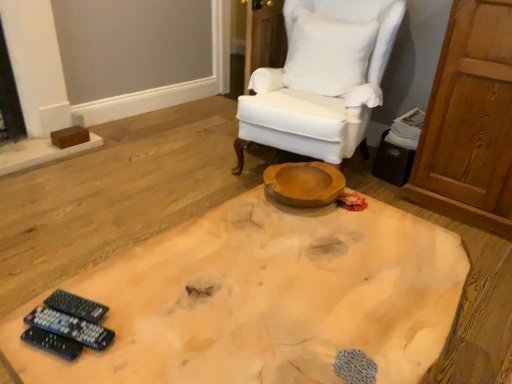
What are the coordinates of `white cotton pillow at upper right` in the screenshot? It's located at pos(327,53).

What do you see at coordinates (327, 53) in the screenshot? I see `white cotton pillow at upper right` at bounding box center [327, 53].

Find the location of a particular element. Image resolution: width=512 pixels, height=384 pixels. white fabric chair at upper center is located at coordinates (324, 83).

You are a GUI agent. You are given a task and a screenshot of the screen. Output one action in this format:
    pyautogui.click(x=<x>, y=<y>)
    Task: Click on the white cotton pillow at upper right
    The image size is (512, 384).
    Given the screenshot: What is the action you would take?
    pyautogui.click(x=327, y=53)

From a real-world perspective, is black plastic remote controls at lower left, the 3th remote control positioned from the front, physically located above or below white cotton pillow at upper right?

Clearly, from a real-world perspective, black plastic remote controls at lower left, the 3th remote control positioned from the front, is below white cotton pillow at upper right.

Considering the sizes of objects black plastic remote controls at lower left, the 1th remote control viewed from the back, and white cotton pillow at upper right in the image provided, who is shorter, black plastic remote controls at lower left, the 1th remote control viewed from the back, or white cotton pillow at upper right?

Standing shorter between the two is black plastic remote controls at lower left, the 1th remote control viewed from the back.

From the picture: Does black plastic remote controls at lower left, the 3th remote control positioned from the front, come behind white cotton pillow at upper right?

No, black plastic remote controls at lower left, the 3th remote control positioned from the front, is closer to the viewer.

Where is `pillow on the right of the black plastic remote controls at lower left, the 3th remote control positioned from the front`? Image resolution: width=512 pixels, height=384 pixels. pillow on the right of the black plastic remote controls at lower left, the 3th remote control positioned from the front is located at coordinates (327, 53).

What's the angular difference between black plastic remote controls at lower left, the 1th remote control viewed from the back, and natural wood coffee table at center's facing directions?

They differ by 20.6 degrees in their facing directions.

From a real-world perspective, which object rests below the other?

natural wood coffee table at center, from a real-world perspective.

Visually, is black plastic remote controls at lower left, the 1th remote control viewed from the back, positioned to the left or to the right of natural wood coffee table at center?

black plastic remote controls at lower left, the 1th remote control viewed from the back, is to the left of natural wood coffee table at center.

Does point (98, 321) come closer to viewer compared to point (198, 305)?

Yes, point (98, 321) is in front of point (198, 305).

Measure the distance from black plastic remote controls at lower left, arranged as the 1th remote control when viewed from the front, to black plastic remote controls at lower left, the 2th remote control viewed from the back.

2.79 centimeters.

Identify the location of the 1st remote control positioned above the black plastic remote controls at lower left, which ranks as the 3th remote control in back-to-front order (from the image's perspective). The height and width of the screenshot is (384, 512). (70, 327).

Is black plastic remote controls at lower left, arranged as the 1th remote control when viewed from the front, located outside black plastic remote controls at lower left, the 2th remote control viewed from the back?

Yes.

Could you tell me if black plastic remote controls at lower left, arranged as the 1th remote control when viewed from the front, is turned towards black plastic remote controls at lower left, which is counted as the 2th remote control, starting from the front?

No, black plastic remote controls at lower left, arranged as the 1th remote control when viewed from the front, is not aimed at black plastic remote controls at lower left, which is counted as the 2th remote control, starting from the front.

Do you think white cotton pillow at upper right is within black plastic remote controls at lower left, the 3th remote control positioned from the front, or outside of it?

white cotton pillow at upper right is outside black plastic remote controls at lower left, the 3th remote control positioned from the front.

Is white cotton pillow at upper right taller or shorter than black plastic remote controls at lower left, the 1th remote control viewed from the back?

white cotton pillow at upper right is taller than black plastic remote controls at lower left, the 1th remote control viewed from the back.

Is white cotton pillow at upper right far from black plastic remote controls at lower left, the 1th remote control viewed from the back?

white cotton pillow at upper right is positioned a significant distance from black plastic remote controls at lower left, the 1th remote control viewed from the back.

Are black plastic remote controls at lower left, which ranks as the 3th remote control in back-to-front order, and natural wood coffee table at center far apart?

They are positioned close to each other.

Considering the positions of points (55, 344) and (230, 348), is point (55, 344) farther from camera compared to point (230, 348)?

No, (55, 344) is in front of (230, 348).

Consider the image. Can you tell me how much black plastic remote controls at lower left, which ranks as the 3th remote control in back-to-front order, and natural wood coffee table at center differ in facing direction?

The facing directions of black plastic remote controls at lower left, which ranks as the 3th remote control in back-to-front order, and natural wood coffee table at center are 18.8 degrees apart.

Starting from the natural wood coffee table at center, which remote control is the 3rd one to the left? Please provide its 2D coordinates.

[(52, 343)]

Is white fabric chair at upper center directly adjacent to natural wood coffee table at center?

No, white fabric chair at upper center is not next to natural wood coffee table at center.

Between white fabric chair at upper center and natural wood coffee table at center, which one has smaller size?

With smaller size is natural wood coffee table at center.

Is natural wood coffee table at center a part of white fabric chair at upper center?

No, natural wood coffee table at center is located outside of white fabric chair at upper center.

How different are the orientations of black plastic remote controls at lower left, the 2th remote control viewed from the back, and white fabric chair at upper center in degrees?

80.8 degrees.

Does point (84, 324) appear closer or farther from the camera than point (366, 73)?

Point (84, 324) is closer to the camera than point (366, 73).

Is white fabric chair at upper center completely or partially inside black plastic remote controls at lower left, which is counted as the 2th remote control, starting from the front?

No, white fabric chair at upper center is not a part of black plastic remote controls at lower left, which is counted as the 2th remote control, starting from the front.

From the picture: Is black plastic remote controls at lower left, the 2th remote control viewed from the back, oriented away from white fabric chair at upper center?

black plastic remote controls at lower left, the 2th remote control viewed from the back, is not turned away from white fabric chair at upper center.

Locate an element on the screen. This screenshot has width=512, height=384. pillow that is behind the black plastic remote controls at lower left, the 3th remote control positioned from the front is located at coordinates (327, 53).

From the image's perspective, count 3rd remote controls upward from the natural wood coffee table at center and point to it. Please provide its 2D coordinates.

[(76, 306)]

Looking at the image, which one is located closer to natural wood coffee table at center, black plastic remote controls at lower left, the 1th remote control viewed from the back, or white cotton pillow at upper right?

black plastic remote controls at lower left, the 1th remote control viewed from the back, is positioned closer to the anchor natural wood coffee table at center.

Considering their positions, is black plastic remote controls at lower left, which ranks as the 3th remote control in back-to-front order, positioned closer to natural wood coffee table at center than black plastic remote controls at lower left, the 3th remote control positioned from the front?

black plastic remote controls at lower left, the 3th remote control positioned from the front.

Looking at the image, which one is located further to black plastic remote controls at lower left, arranged as the 1th remote control when viewed from the front, natural wood coffee table at center or black plastic remote controls at lower left, the 2th remote control viewed from the back?

natural wood coffee table at center.

Estimate the real-world distances between objects in this image. Which object is further from black plastic remote controls at lower left, which ranks as the 3th remote control in back-to-front order, black plastic remote controls at lower left, the 1th remote control viewed from the back, or black plastic remote controls at lower left, which is counted as the 2th remote control, starting from the front?

Based on the image, black plastic remote controls at lower left, the 1th remote control viewed from the back, appears to be further to black plastic remote controls at lower left, which ranks as the 3th remote control in back-to-front order.

Which object lies nearer to the anchor point white cotton pillow at upper right, natural wood coffee table at center or black plastic remote controls at lower left, the 1th remote control viewed from the back?

natural wood coffee table at center is closer to white cotton pillow at upper right.

Based on their spatial positions, is black plastic remote controls at lower left, arranged as the 1th remote control when viewed from the front, or black plastic remote controls at lower left, which is counted as the 2th remote control, starting from the front, further from black plastic remote controls at lower left, the 1th remote control viewed from the back?

Based on the image, black plastic remote controls at lower left, arranged as the 1th remote control when viewed from the front, appears to be further to black plastic remote controls at lower left, the 1th remote control viewed from the back.

Which object lies nearer to the anchor point natural wood coffee table at center, black plastic remote controls at lower left, the 1th remote control viewed from the back, or white fabric chair at upper center?

black plastic remote controls at lower left, the 1th remote control viewed from the back, is positioned closer to the anchor natural wood coffee table at center.

In the scene shown: Based on their spatial positions, is black plastic remote controls at lower left, the 2th remote control viewed from the back, or white cotton pillow at upper right closer to natural wood coffee table at center?

black plastic remote controls at lower left, the 2th remote control viewed from the back, is closer to natural wood coffee table at center.

Where is `chair positioned between black plastic remote controls at lower left, which is counted as the 2th remote control, starting from the front, and white cotton pillow at upper right from near to far`? Image resolution: width=512 pixels, height=384 pixels. chair positioned between black plastic remote controls at lower left, which is counted as the 2th remote control, starting from the front, and white cotton pillow at upper right from near to far is located at coordinates (324, 83).

Locate an element on the screen. The height and width of the screenshot is (384, 512). chair located between natural wood coffee table at center and white cotton pillow at upper right in the depth direction is located at coordinates (324, 83).

At what (x,y) coordinates should I click in order to perform the action: click on remote control between black plastic remote controls at lower left, which is counted as the 2th remote control, starting from the front, and white cotton pillow at upper right from front to back. Please return your answer as a coordinate pair (x, y). Looking at the image, I should click on (76, 306).

I want to click on chair located between black plastic remote controls at lower left, the 1th remote control viewed from the back, and white cotton pillow at upper right in the depth direction, so click(x=324, y=83).